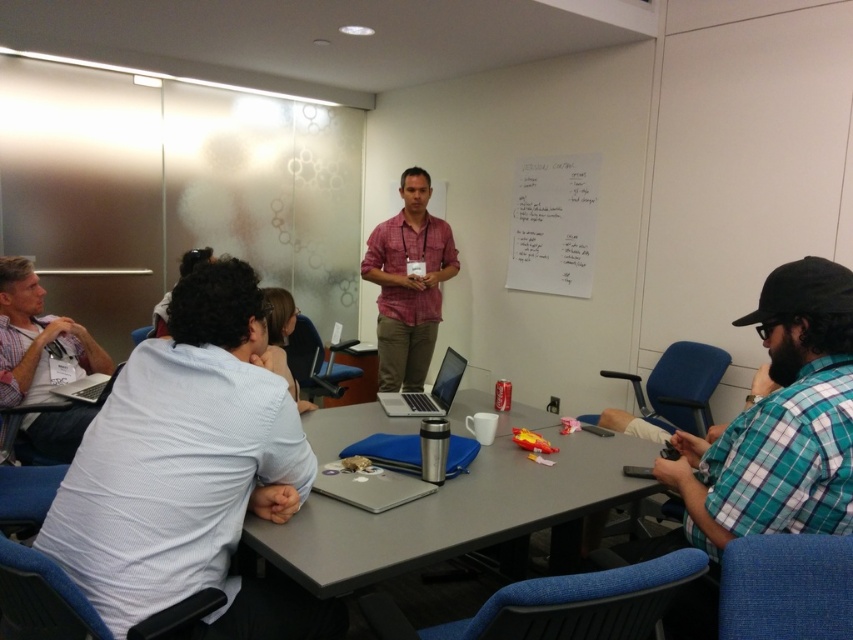
You are organizing a photo shoot and need to place a 12 inch wide prop between the white textured shirt at lower left and the matte white shirt at left. Based on their widths, will the prop fit between them?

The white textured shirt at lower left might be wider than the matte white shirt at left, so the total space between them could accommodate the 12 inch prop if the combined width allows. However, without exact measurements, it is uncertain. Check the actual distance before placing the prop.

You are an attendee at the conference and you want to identify the person wearing the white textured shirt at lower left. Which direction should you look relative to the matte white shirt at left?

The white textured shirt at lower left is below the matte white shirt at left, so you should look downward from the matte white shirt at left to find the white textured shirt at lower left.

You are organizing a photoshoot and need to ensure that the shirts in the image are sized appropriately for the models. Given that the white textured shirt at lower left and the matte pink shirt at center are both part of the shoot, which shirt would you choose if you want to use the larger one for a model with a bigger frame?

The white textured shirt at lower left is bigger than the matte pink shirt at center, so it would be the better choice for a model with a larger frame.